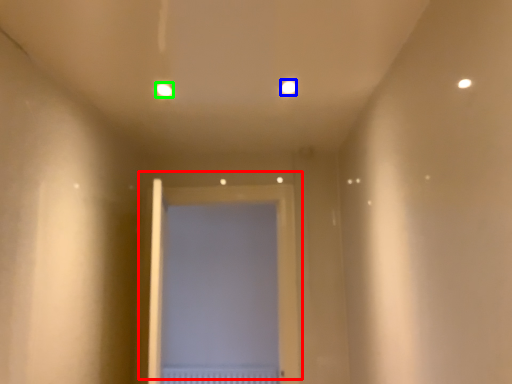
Question: Considering the real-world distances, which object is farthest from door (highlighted by a red box)? light (highlighted by a blue box) or light (highlighted by a green box)?

Choices:
 (A) light
 (B) light

Answer: (B)